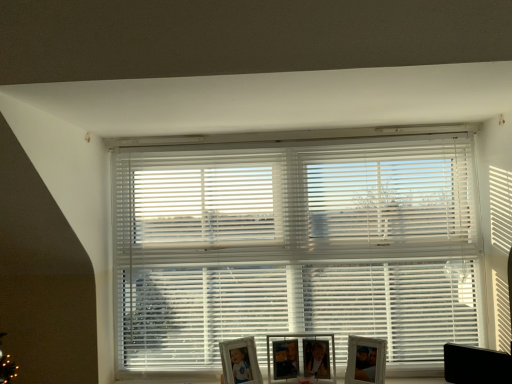
Measure the distance between black plastic swivel chair at lower right and camera.

5.80 feet.

Locate an element on the screen. black plastic swivel chair at lower right is located at coordinates (476, 365).

Where is `white plastic blinds at center`? The image size is (512, 384). white plastic blinds at center is located at coordinates (294, 247).

Describe the element at coordinates (240, 361) in the screenshot. I see `matte silver picture frame at lower center, the 3th picture frame in the right-to-left sequence` at that location.

This screenshot has height=384, width=512. In order to click on wooden photo frame at lower right, acting as the first picture frame starting from the right in this screenshot , I will do `click(366, 360)`.

From a real-world perspective, is black plastic swivel chair at lower right above or below matte silver picture frame at lower center, which is the 1th picture frame from left to right?

black plastic swivel chair at lower right is situated lower than matte silver picture frame at lower center, which is the 1th picture frame from left to right, in the real world.

Which is correct: black plastic swivel chair at lower right is inside matte silver picture frame at lower center, the 3th picture frame in the right-to-left sequence, or outside of it?

black plastic swivel chair at lower right is not inside matte silver picture frame at lower center, the 3th picture frame in the right-to-left sequence, it's outside.

Is black plastic swivel chair at lower right at the left side of matte silver picture frame at lower center, the 3th picture frame in the right-to-left sequence?

In fact, black plastic swivel chair at lower right is to the right of matte silver picture frame at lower center, the 3th picture frame in the right-to-left sequence.

Can you confirm if black plastic swivel chair at lower right is shorter than matte silver picture frame at lower center, the 3th picture frame in the right-to-left sequence?

Yes.

Is wooden photo frame at center, the second picture frame positioned from the left, positioned with its back to black plastic swivel chair at lower right?

No.

Based on the photo, considering the sizes of objects wooden photo frame at center, which ranks as the second picture frame in right-to-left order, and black plastic swivel chair at lower right in the image provided, who is wider, wooden photo frame at center, which ranks as the second picture frame in right-to-left order, or black plastic swivel chair at lower right?

wooden photo frame at center, which ranks as the second picture frame in right-to-left order.

From the picture: Which is correct: wooden photo frame at center, the second picture frame positioned from the left, is inside black plastic swivel chair at lower right, or outside of it?

wooden photo frame at center, the second picture frame positioned from the left, is not enclosed by black plastic swivel chair at lower right.

From a real-world perspective, which is physically below, wooden photo frame at center, the second picture frame positioned from the left, or black plastic swivel chair at lower right?

black plastic swivel chair at lower right.

Does black plastic swivel chair at lower right have a lesser height compared to white plastic blinds at center?

Yes, black plastic swivel chair at lower right is shorter than white plastic blinds at center.

Considering the sizes of objects black plastic swivel chair at lower right and white plastic blinds at center in the image provided, who is wider, black plastic swivel chair at lower right or white plastic blinds at center?

white plastic blinds at center.

Does black plastic swivel chair at lower right appear on the right side of white plastic blinds at center?

Indeed, black plastic swivel chair at lower right is positioned on the right side of white plastic blinds at center.

Can you tell me how much wooden photo frame at lower right, acting as the first picture frame starting from the right, and white plastic blinds at center differ in facing direction?

The angular difference between wooden photo frame at lower right, acting as the first picture frame starting from the right, and white plastic blinds at center is 30.6 degrees.

Could you measure the distance between wooden photo frame at lower right, the 3th picture frame positioned from the left, and white plastic blinds at center?

wooden photo frame at lower right, the 3th picture frame positioned from the left, and white plastic blinds at center are 53.07 centimeters apart from each other.

Which object is wider, wooden photo frame at lower right, acting as the first picture frame starting from the right, or white plastic blinds at center?

white plastic blinds at center is wider.

Considering the sizes of objects wooden photo frame at lower right, acting as the first picture frame starting from the right, and white plastic blinds at center in the image provided, who is smaller, wooden photo frame at lower right, acting as the first picture frame starting from the right, or white plastic blinds at center?

wooden photo frame at lower right, acting as the first picture frame starting from the right.

Is wooden photo frame at center, which ranks as the second picture frame in right-to-left order, outside of matte silver picture frame at lower center, which is the 1th picture frame from left to right?

Yes, wooden photo frame at center, which ranks as the second picture frame in right-to-left order, is not within matte silver picture frame at lower center, which is the 1th picture frame from left to right.

The image size is (512, 384). In order to click on picture frame below the wooden photo frame at center, the second picture frame positioned from the left (from the image's perspective) in this screenshot , I will do (240, 361).

Consider the image. Is wooden photo frame at center, which ranks as the second picture frame in right-to-left order, beside matte silver picture frame at lower center, which is the 1th picture frame from left to right?

No, wooden photo frame at center, which ranks as the second picture frame in right-to-left order, is not beside matte silver picture frame at lower center, which is the 1th picture frame from left to right.

Considering the positions of objects wooden photo frame at center, which ranks as the second picture frame in right-to-left order, and matte silver picture frame at lower center, the 3th picture frame in the right-to-left sequence, in the image provided, who is more to the right, wooden photo frame at center, which ranks as the second picture frame in right-to-left order, or matte silver picture frame at lower center, the 3th picture frame in the right-to-left sequence,?

wooden photo frame at center, which ranks as the second picture frame in right-to-left order.

Where is `the 2nd picture frame below when counting from the black plastic swivel chair at lower right (from the image's perspective)`? The height and width of the screenshot is (384, 512). the 2nd picture frame below when counting from the black plastic swivel chair at lower right (from the image's perspective) is located at coordinates (301, 358).

Is black plastic swivel chair at lower right positioned behind wooden photo frame at center, which ranks as the second picture frame in right-to-left order?

That is False.

In terms of size, does black plastic swivel chair at lower right appear bigger or smaller than wooden photo frame at center, the second picture frame positioned from the left?

Clearly, black plastic swivel chair at lower right is smaller in size than wooden photo frame at center, the second picture frame positioned from the left.

Which is farther from the camera, [456,370] or [315,338]?

The point [315,338] is behind.

From a real-world perspective, between matte silver picture frame at lower center, which is the 1th picture frame from left to right, and wooden photo frame at lower right, acting as the first picture frame starting from the right, who is vertically lower?

In real-world perspective, matte silver picture frame at lower center, which is the 1th picture frame from left to right, is lower.

From the image's perspective, is matte silver picture frame at lower center, the 3th picture frame in the right-to-left sequence, located above wooden photo frame at lower right, the 3th picture frame positioned from the left?

No.

Which is farther, (241, 369) or (349, 345)?

The point (349, 345) is farther from the camera.

In terms of height, does matte silver picture frame at lower center, which is the 1th picture frame from left to right, look taller or shorter compared to wooden photo frame at lower right, acting as the first picture frame starting from the right?

In the image, matte silver picture frame at lower center, which is the 1th picture frame from left to right, appears to be shorter than wooden photo frame at lower right, acting as the first picture frame starting from the right.

Where is `picture frame that is the 1st one above the black plastic swivel chair at lower right (from a real-world perspective)`? This screenshot has width=512, height=384. picture frame that is the 1st one above the black plastic swivel chair at lower right (from a real-world perspective) is located at coordinates (240, 361).

Where is `swivel chair that appears on the right of wooden photo frame at center, which ranks as the second picture frame in right-to-left order`? The height and width of the screenshot is (384, 512). swivel chair that appears on the right of wooden photo frame at center, which ranks as the second picture frame in right-to-left order is located at coordinates (476, 365).

Considering their positions, is wooden photo frame at lower right, acting as the first picture frame starting from the right, positioned closer to matte silver picture frame at lower center, the 3th picture frame in the right-to-left sequence, than white plastic blinds at center?

Among the two, wooden photo frame at lower right, acting as the first picture frame starting from the right, is located nearer to matte silver picture frame at lower center, the 3th picture frame in the right-to-left sequence.

When comparing their distances from white plastic blinds at center, does black plastic swivel chair at lower right or wooden photo frame at lower right, acting as the first picture frame starting from the right, seem closer?

wooden photo frame at lower right, acting as the first picture frame starting from the right, lies closer to white plastic blinds at center than the other object.

Estimate the real-world distances between objects in this image. Which object is closer to wooden photo frame at lower right, acting as the first picture frame starting from the right, wooden photo frame at center, the second picture frame positioned from the left, or matte silver picture frame at lower center, which is the 1th picture frame from left to right?

Among the two, wooden photo frame at center, the second picture frame positioned from the left, is located nearer to wooden photo frame at lower right, acting as the first picture frame starting from the right.

From the image, which object appears to be nearer to white plastic blinds at center, wooden photo frame at lower right, acting as the first picture frame starting from the right, or matte silver picture frame at lower center, which is the 1th picture frame from left to right?

matte silver picture frame at lower center, which is the 1th picture frame from left to right, is closer to white plastic blinds at center.

From the image, which object appears to be nearer to black plastic swivel chair at lower right, matte silver picture frame at lower center, which is the 1th picture frame from left to right, or wooden photo frame at center, the second picture frame positioned from the left?

The object closer to black plastic swivel chair at lower right is wooden photo frame at center, the second picture frame positioned from the left.

Based on their spatial positions, is wooden photo frame at lower right, acting as the first picture frame starting from the right, or black plastic swivel chair at lower right closer to wooden photo frame at center, which ranks as the second picture frame in right-to-left order?

wooden photo frame at lower right, acting as the first picture frame starting from the right, is closer to wooden photo frame at center, which ranks as the second picture frame in right-to-left order.

Estimate the real-world distances between objects in this image. Which object is further from matte silver picture frame at lower center, which is the 1th picture frame from left to right, white plastic blinds at center or wooden photo frame at center, the second picture frame positioned from the left?

white plastic blinds at center.

Considering their positions, is white plastic blinds at center positioned closer to black plastic swivel chair at lower right than wooden photo frame at lower right, the 3th picture frame positioned from the left?

wooden photo frame at lower right, the 3th picture frame positioned from the left, lies closer to black plastic swivel chair at lower right than the other object.

This screenshot has height=384, width=512. Identify the location of window blind between matte silver picture frame at lower center, which is the 1th picture frame from left to right, and black plastic swivel chair at lower right. (294, 247).

You are a GUI agent. You are given a task and a screenshot of the screen. Output one action in this format:
    pyautogui.click(x=<x>, y=<y>)
    Task: Click on the picture frame situated between wooden photo frame at center, which ranks as the second picture frame in right-to-left order, and black plastic swivel chair at lower right from left to right
    
    Given the screenshot: What is the action you would take?
    pyautogui.click(x=366, y=360)

Identify the location of window blind between matte silver picture frame at lower center, which is the 1th picture frame from left to right, and wooden photo frame at lower right, acting as the first picture frame starting from the right. [x=294, y=247].

Identify the location of picture frame located between matte silver picture frame at lower center, the 3th picture frame in the right-to-left sequence, and wooden photo frame at lower right, the 3th picture frame positioned from the left, in the left-right direction. (301, 358).